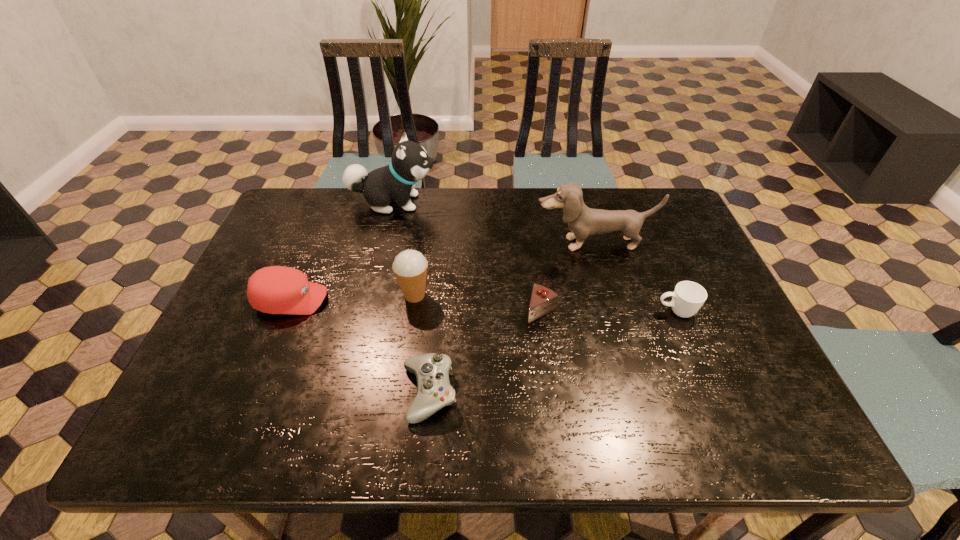
The image size is (960, 540). I want to click on free location located at the face of the right puppy, so click(630, 375).

You are a GUI agent. You are given a task and a screenshot of the screen. Output one action in this format:
    pyautogui.click(x=<x>, y=<y>)
    Task: Click on the blank area located 0.150m on the right of the third tallest object
    This screenshot has width=960, height=540.
    Given the screenshot: What is the action you would take?
    pyautogui.click(x=489, y=295)

At what (x,y) coordinates should I click in order to perform the action: click on vacant space located 0.330m on the front-facing side of the fourth tallest object. Please return your answer as a coordinate pair (x, y). The image size is (960, 540). Looking at the image, I should click on (457, 300).

This screenshot has width=960, height=540. I want to click on vacant area situated with the handle on the side of the cup, so click(632, 312).

Find the location of a particular element. This screenshot has width=960, height=540. vacant region located 0.150m with the handle on the side of the cup is located at coordinates (596, 312).

The height and width of the screenshot is (540, 960). In order to click on vacant region located 0.310m with the handle on the side of the cup in this screenshot , I will do `click(532, 312)`.

This screenshot has width=960, height=540. Identify the location of vacant area located 0.080m on the left of the chocolate cake. (493, 310).

The width and height of the screenshot is (960, 540). Identify the location of vacant area situated on the left of the nearest object. (252, 393).

Locate an element on the screen. The height and width of the screenshot is (540, 960). object positioned at the near edge is located at coordinates (434, 391).

Identify the location of object present at the left edge. (275, 289).